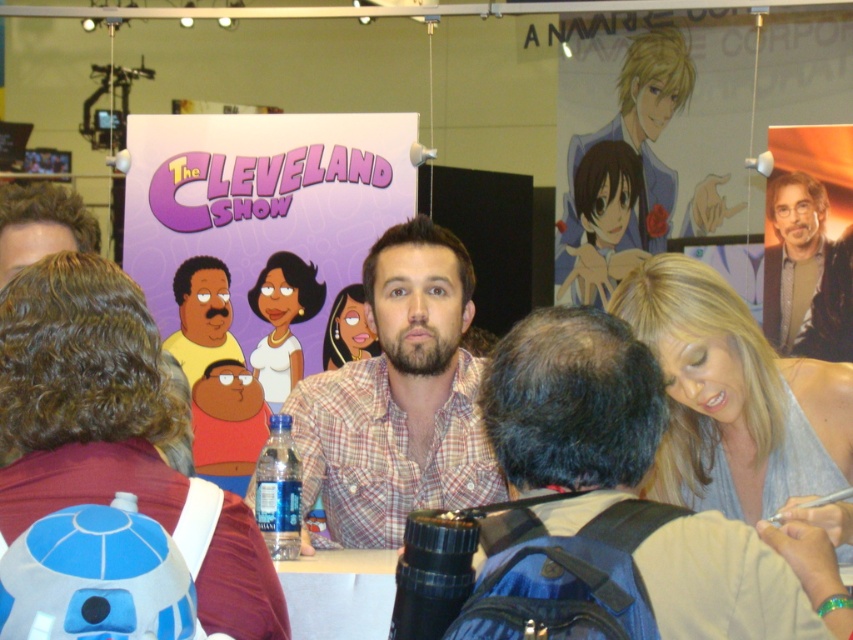
Question: Considering the real-world distances, which object is closest to the smooth white shirt at center?

Choices:
 (A) smooth skin face at center
 (B) shiny silver hair at upper right
 (C) plaid cotton shirt at center
 (D) blue fabric poster at upper right

Answer: (A)

Question: Which point is closer to the camera?

Choices:
 (A) shiny silver hair at upper right
 (B) plaid cotton shirt at center

Answer: (B)

Question: Can you confirm if plaid shirt at center is positioned to the left of shiny silver hair at upper right?

Choices:
 (A) yes
 (B) no

Answer: (A)

Question: Is plaid cotton shirt at center positioned in front of smooth skin face at center?

Choices:
 (A) yes
 (B) no

Answer: (A)

Question: Does plaid shirt at center have a smaller size compared to smooth skin face at center?

Choices:
 (A) yes
 (B) no

Answer: (B)

Question: Which of these objects is positioned closest to the plaid cotton shirt at center?

Choices:
 (A) shiny silver hair at upper right
 (B) smooth white shirt at center

Answer: (B)